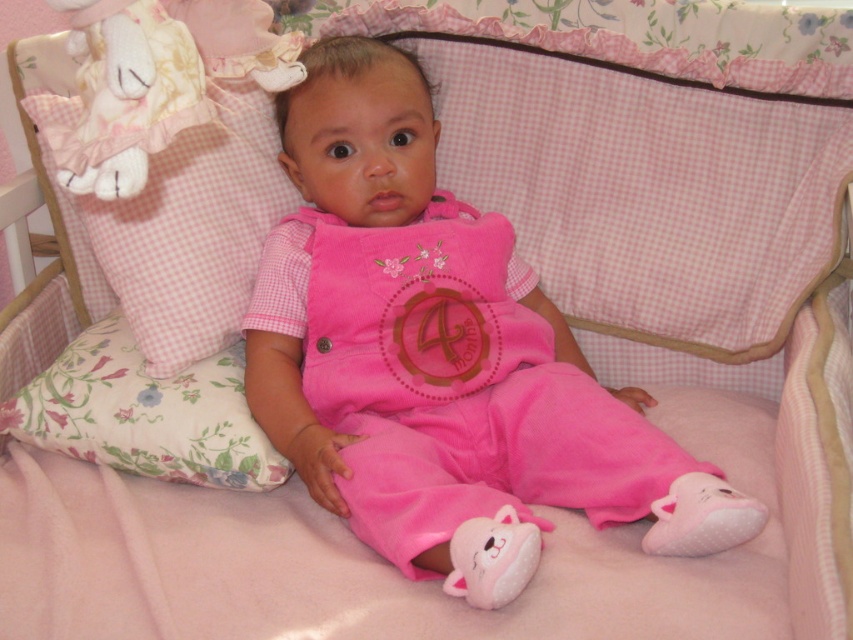
In the scene shown: Is pink velvety onesie at center closer to camera compared to floral fabric pillow at lower left?

Yes, it is.

Is pink velvety onesie at center to the left of floral fabric pillow at lower left from the viewer's perspective?

Incorrect, pink velvety onesie at center is not on the left side of floral fabric pillow at lower left.

Identify the location of pink velvety onesie at center. (437, 346).

Is point (251, 124) positioned behind point (77, 29)?

Yes, point (251, 124) is farther from viewer.

Who is more forward, (90,33) or (90,20)?

Point (90,20) is in front.

Which is behind, point (106, 20) or point (270, 29)?

The point (270, 29) is behind.

Where is `pink gingham pillow at upper left`? The image size is (853, 640). pink gingham pillow at upper left is located at coordinates (157, 81).

Is pink velvety onesie at center further to camera compared to pink gingham pillow at upper left?

Yes, it is.

Does point (328, 198) come in front of point (172, 129)?

No, it is behind (172, 129).

The width and height of the screenshot is (853, 640). What are the coordinates of `pink velvety onesie at center` in the screenshot? It's located at (437, 346).